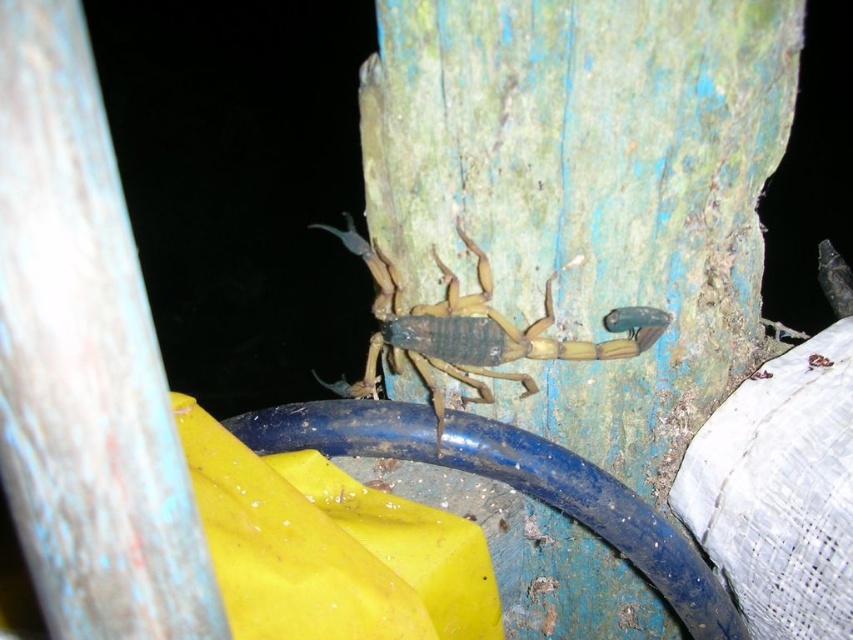
You are a photographer taking a picture of the scorpion in the image. You want to focus on the point that is closer to you. Which point should you choose between point (506, 548) and point (345, 248)?

Point (506, 548) is closer to the viewer than point (345, 248), so you should choose point (506, 548) to focus on the closer point.

You are an entomologist examining the scorpion in the image. You notice a specific point marked at coordinates [589,189]. What does this point represent in the scene?

The point at [589,189] indicates green weathered wood at center.

In the scene shown: Based on the scene description, where is the smooth blue wood at center located in the image?

The smooth blue wood at center is located at point coordinates of 0.566 on the x axis and 0.100 on the y axis.